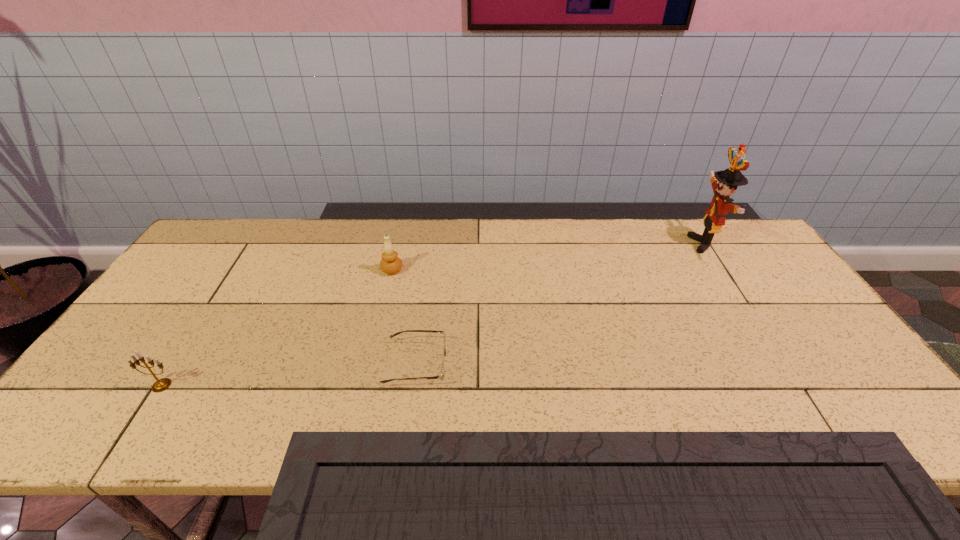
At what (x,y) coordinates should I click in order to perform the action: click on free space between the spectacles and the second object from left to right. Please return your answer as a coordinate pair (x, y). The image size is (960, 540). Looking at the image, I should click on (404, 317).

You are a GUI agent. You are given a task and a screenshot of the screen. Output one action in this format:
    pyautogui.click(x=<x>, y=<y>)
    Task: Click on the vacant space in between the leftmost object and the shortest object
    The image size is (960, 540).
    Given the screenshot: What is the action you would take?
    pyautogui.click(x=289, y=375)

Image resolution: width=960 pixels, height=540 pixels. Identify the location of unoccupied area between the left candelabrum and the rightmost object. (433, 315).

Locate an element on the screen. vacant space that's between the third object from left to right and the rightmost object is located at coordinates (561, 304).

Where is `object that ranks as the closest to the nutcracker`? object that ranks as the closest to the nutcracker is located at coordinates (441, 376).

Identify which object is located as the nearest to the nutcracker. Please provide its 2D coordinates. Your answer should be formatted as a tuple, i.e. [(x, y)], where the tuple contains the x and y coordinates of a point satisfying the conditions above.

[(441, 376)]

You are a GUI agent. You are given a task and a screenshot of the screen. Output one action in this format:
    pyautogui.click(x=<x>, y=<y>)
    Task: Click on the vacant area in the image that satisfies the following two spatial constraints: 1. on the back side of the leftmost object; 2. on the left side of the right candelabrum
    This screenshot has width=960, height=540.
    Given the screenshot: What is the action you would take?
    pyautogui.click(x=236, y=270)

Where is `free spot that satisfies the following two spatial constraints: 1. on the front-facing side of the tallest object; 2. on the front side of the leftmost object`? free spot that satisfies the following two spatial constraints: 1. on the front-facing side of the tallest object; 2. on the front side of the leftmost object is located at coordinates (795, 386).